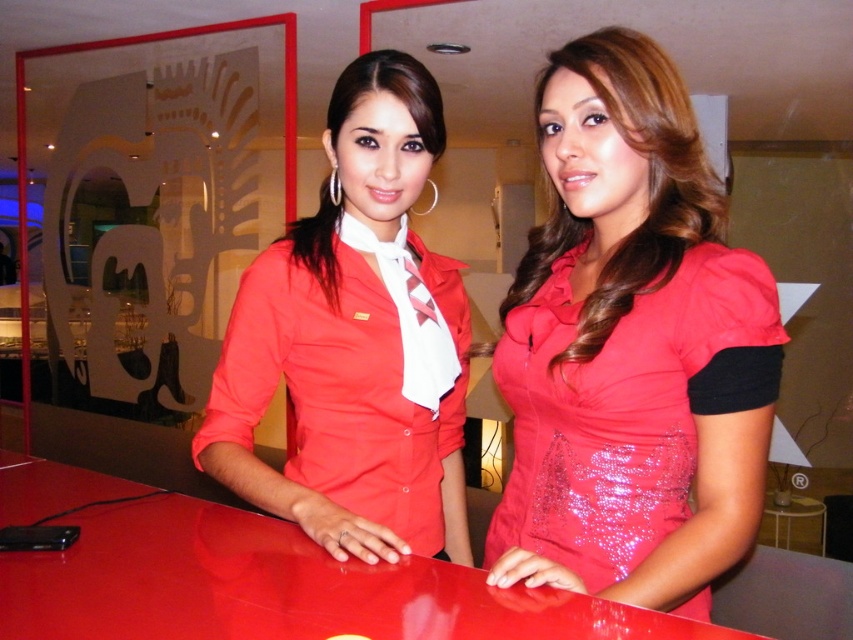
Question: Estimate the real-world distances between objects in this image. Which object is farther from the glossy red table at center?

Choices:
 (A) matte red shirt at center
 (B) shiny red dress at center

Answer: (B)

Question: Which is farther from the glossy red table at center?

Choices:
 (A) shiny red dress at center
 (B) matte red shirt at center

Answer: (A)

Question: Which object is closer to the camera taking this photo?

Choices:
 (A) matte red shirt at center
 (B) glossy red table at center
 (C) shiny red dress at center

Answer: (B)

Question: Does matte red shirt at center have a larger size compared to glossy red table at center?

Choices:
 (A) yes
 (B) no

Answer: (A)

Question: Does shiny red dress at center come in front of glossy red table at center?

Choices:
 (A) no
 (B) yes

Answer: (A)

Question: Is matte red shirt at center positioned behind glossy red table at center?

Choices:
 (A) yes
 (B) no

Answer: (A)